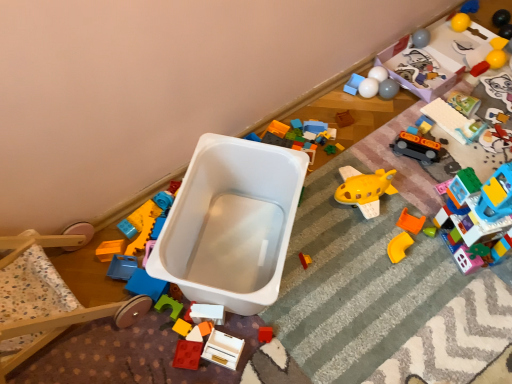
Find the location of a particular element. free space in front of matte gray cat at upper right, which is the fifteenth toy in left-to-right order is located at coordinates (496, 131).